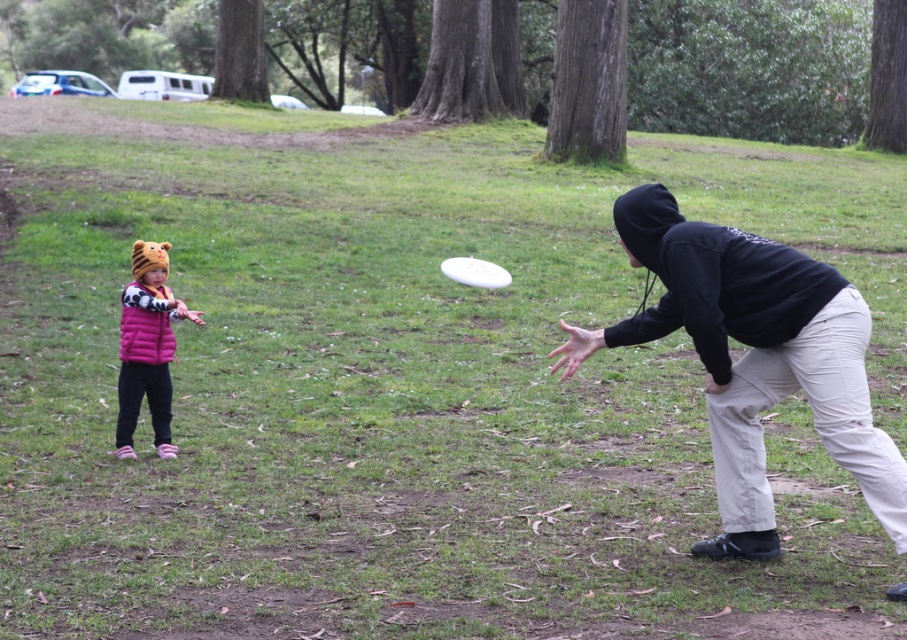
Who is lower down, black matte hoodie at center or pink puffy vest at left?

Positioned lower is black matte hoodie at center.

Between point (744, 403) and point (141, 305), which one is positioned in front?

Positioned in front is point (744, 403).

Between point (739, 515) and point (135, 406), which one is positioned in front?

Point (739, 515) is more forward.

The width and height of the screenshot is (907, 640). Identify the location of black matte hoodie at center. (754, 358).

Does point (818, 392) lie behind point (469, 273)?

No, (818, 392) is closer to viewer.

Does point (802, 284) come in front of point (462, 276)?

Yes, point (802, 284) is closer to viewer.

Locate an element on the screen. black matte hoodie at center is located at coordinates pos(754,358).

Does pink puffy vest at left have a larger size compared to white plastic frisbee at center?

Correct, pink puffy vest at left is larger in size than white plastic frisbee at center.

Is pink puffy vest at left to the right of white plastic frisbee at center from the viewer's perspective?

In fact, pink puffy vest at left is to the left of white plastic frisbee at center.

I want to click on pink puffy vest at left, so click(147, 348).